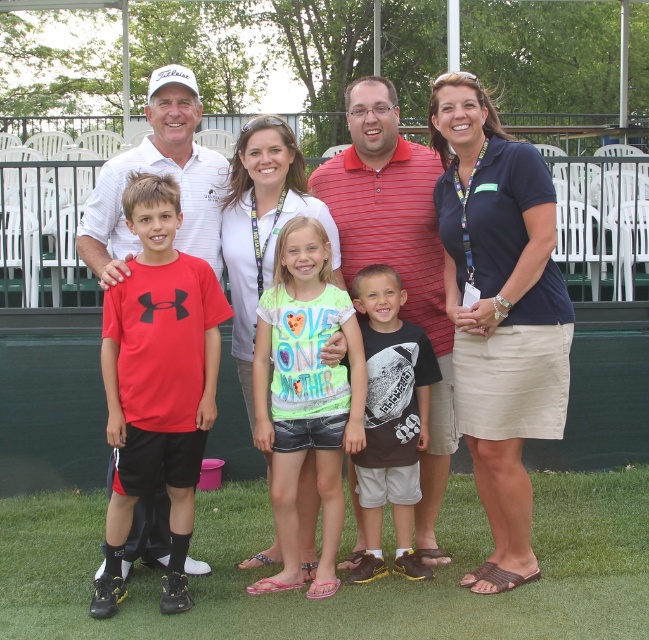
Does point (482, 124) lie in front of point (485, 452)?

No, (482, 124) is behind (485, 452).

Describe the element at coordinates (463, 280) in the screenshot. The image size is (649, 640). I see `matte red t-shirt at center` at that location.

The width and height of the screenshot is (649, 640). I want to click on matte red t-shirt at center, so click(x=463, y=280).

Can you confirm if navy blue shirt at right is shorter than red matte t-shirt at center?

No, navy blue shirt at right is not shorter than red matte t-shirt at center.

Which of these two, navy blue shirt at right or red matte t-shirt at center, stands taller?

With more height is navy blue shirt at right.

Is point (569, 310) positioned in front of point (151, 461)?

No, it is not.

The width and height of the screenshot is (649, 640). What are the coordinates of `navy blue shirt at right` in the screenshot? It's located at (498, 312).

Can you confirm if neon green t-shirt at center is thinner than dark brown cotton t-shirt at center?

No.

Measure the distance from neon green t-shirt at center to dark brown cotton t-shirt at center.

neon green t-shirt at center and dark brown cotton t-shirt at center are 12.89 inches apart from each other.

Image resolution: width=649 pixels, height=640 pixels. What do you see at coordinates (304, 396) in the screenshot? I see `neon green t-shirt at center` at bounding box center [304, 396].

The width and height of the screenshot is (649, 640). I want to click on neon green t-shirt at center, so click(x=304, y=396).